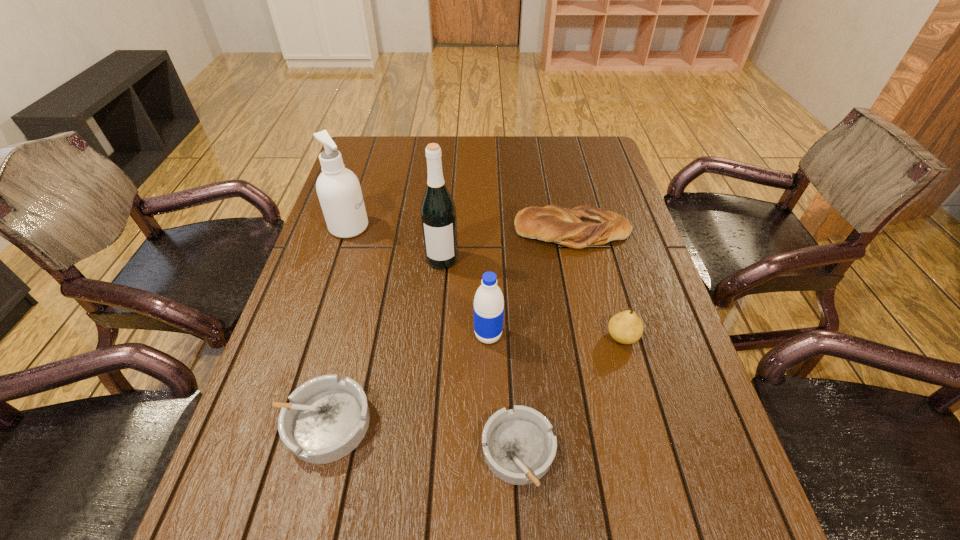
I want to click on free space located on the left of the right ashtray, so click(391, 452).

You are a GUI agent. You are given a task and a screenshot of the screen. Output one action in this format:
    pyautogui.click(x=<x>, y=<y>)
    Task: Click on the vacant space located on the label of the fifth object from right to left
    
    Given the screenshot: What is the action you would take?
    pyautogui.click(x=439, y=302)

Where is `free space located 0.260m on the back of the bread`? Image resolution: width=960 pixels, height=540 pixels. free space located 0.260m on the back of the bread is located at coordinates (559, 167).

Locate an element on the screen. This screenshot has width=960, height=540. vacant space located 0.160m on the front label of the second tallest object is located at coordinates (423, 227).

Find the location of a particular element. The height and width of the screenshot is (540, 960). free spot located 0.050m on the right of the fifth shortest object is located at coordinates (524, 335).

Where is `free space located on the left of the fourth shortest object`? Image resolution: width=960 pixels, height=540 pixels. free space located on the left of the fourth shortest object is located at coordinates (536, 337).

You are a GUI agent. You are given a task and a screenshot of the screen. Output one action in this format:
    pyautogui.click(x=<x>, y=<y>)
    Task: Click on the ashtray that is at the left edge
    The image size is (960, 540).
    Given the screenshot: What is the action you would take?
    pyautogui.click(x=327, y=417)

At what (x,y) coordinates should I click in order to perform the action: click on cleansing agent at the left edge. Please return your answer as a coordinate pair (x, y). Looking at the image, I should click on (338, 189).

Locate an element on the screen. The width and height of the screenshot is (960, 540). bread that is at the right edge is located at coordinates (582, 226).

You are a GUI agent. You are given a task and a screenshot of the screen. Output one action in this format:
    pyautogui.click(x=<x>, y=<y>)
    Task: Click on the pear located at the right edge
    This screenshot has width=960, height=540.
    Given the screenshot: What is the action you would take?
    pyautogui.click(x=626, y=327)